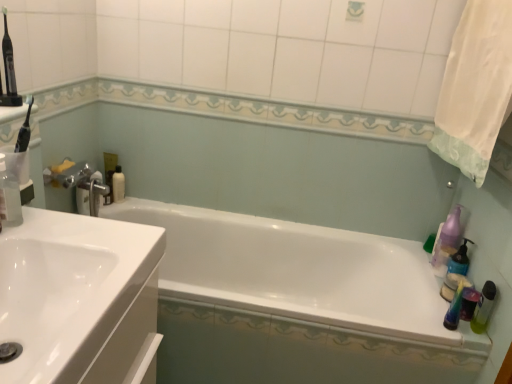
Question: Is white glossy sink at left to the left or to the right of purple translucent soap dispenser at right, positioned as the third cleaning product in left-to-right order, in the image?

Choices:
 (A) left
 (B) right

Answer: (A)

Question: Considering their positions, is white glossy sink at left located in front of or behind purple translucent soap dispenser at right, which is the 1th cleaning product in right-to-left order?

Choices:
 (A) behind
 (B) front

Answer: (B)

Question: Which object is positioned closest to the white glossy bathtub at center?

Choices:
 (A) translucent plastic pump bottle at right, which is counted as the second cleaning product, starting from the front
 (B) purple translucent soap dispenser at right, which is the 1th cleaning product in right-to-left order
 (C) white fabric shower curtain at upper right
 (D) translucent plastic bottle at right
 (E) white glossy bottle at upper left, the 1th mouthwash from the left

Answer: (B)

Question: Estimate the real-world distances between objects in this image. Which object is closer to the translucent plastic pump bottle at right, acting as the 2th cleaning product starting from the back?

Choices:
 (A) white glossy sink at left
 (B) transparent plastic bottle at left, the 1th cleaning product when ordered from left to right
 (C) white glossy bathtub at center
 (D) white glossy bottle at upper left, the 1th mouthwash from the left
 (E) translucent plastic bottle at right

Answer: (E)